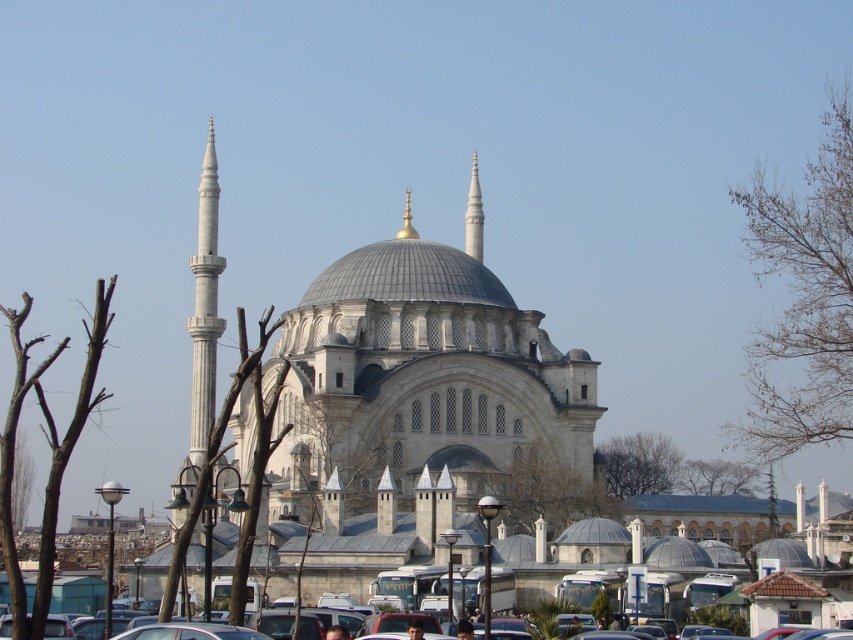
You are standing in front of the grand mosque and notice two points marked on the facade. The first point is at coordinates point (15, 401) and the second is at point (505, 504). Which point is nearer to you?

Point (15, 401) is closer to the viewer than point (505, 504).

You are standing in front of the grand mosque and want to take a photo that includes both the bare branches at upper right and the green leafy tree at upper center. Given that your camera has a 50mm lens, which has a field of view of approximately 46 degrees, can you estimate if both objects will fit in the frame without moving your position?

The distance between the bare branches at upper right and the green leafy tree at upper center is 16.12 meters. With a 50mm lens providing a 46 degree field of view, the horizontal coverage at your camera position would depend on the distance from the mosque. However, since the objects are positioned at the upper sections of the image, their separation might fall within the lens coverage if you frame the upper part of the mosque. Without exact distance measurements to the objects, precise calculation isn